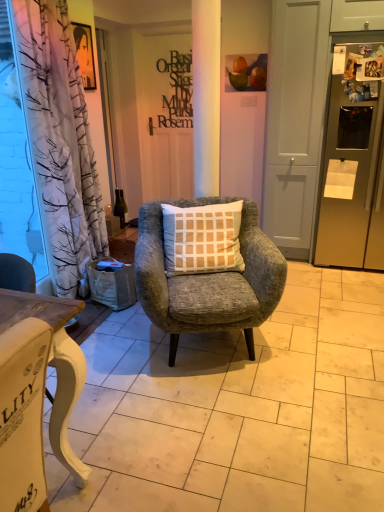
Question: Should I look upward or downward to see white matte screen door at center?

Choices:
 (A) down
 (B) up

Answer: (B)

Question: Is textured gray armchair at center shorter than matte black sign at center?

Choices:
 (A) no
 (B) yes

Answer: (A)

Question: Is matte black sign at center a part of textured gray armchair at center?

Choices:
 (A) no
 (B) yes

Answer: (A)

Question: Can you confirm if textured gray armchair at center is wider than matte black sign at center?

Choices:
 (A) yes
 (B) no

Answer: (A)

Question: From a real-world perspective, is textured gray armchair at center physically below matte black sign at center?

Choices:
 (A) yes
 (B) no

Answer: (A)

Question: From a real-world perspective, is textured gray armchair at center over matte black sign at center?

Choices:
 (A) no
 (B) yes

Answer: (A)

Question: Does textured gray armchair at center have a lesser width compared to matte black sign at center?

Choices:
 (A) no
 (B) yes

Answer: (A)

Question: Can you confirm if textured gray armchair at center is shorter than transparent plastic curtain at left?

Choices:
 (A) no
 (B) yes

Answer: (B)

Question: Does textured gray armchair at center appear on the right side of transparent plastic curtain at left?

Choices:
 (A) no
 (B) yes

Answer: (B)

Question: From a real-world perspective, does textured gray armchair at center sit lower than transparent plastic curtain at left?

Choices:
 (A) no
 (B) yes

Answer: (B)

Question: Is textured gray armchair at center positioned beyond the bounds of transparent plastic curtain at left?

Choices:
 (A) no
 (B) yes

Answer: (B)

Question: Is the depth of textured gray armchair at center greater than that of transparent plastic curtain at left?

Choices:
 (A) no
 (B) yes

Answer: (A)

Question: From the image's perspective, is textured gray armchair at center under transparent plastic curtain at left?

Choices:
 (A) no
 (B) yes

Answer: (B)

Question: Is matte black sign at center closer to the viewer compared to transparent plastic curtain at left?

Choices:
 (A) yes
 (B) no

Answer: (B)